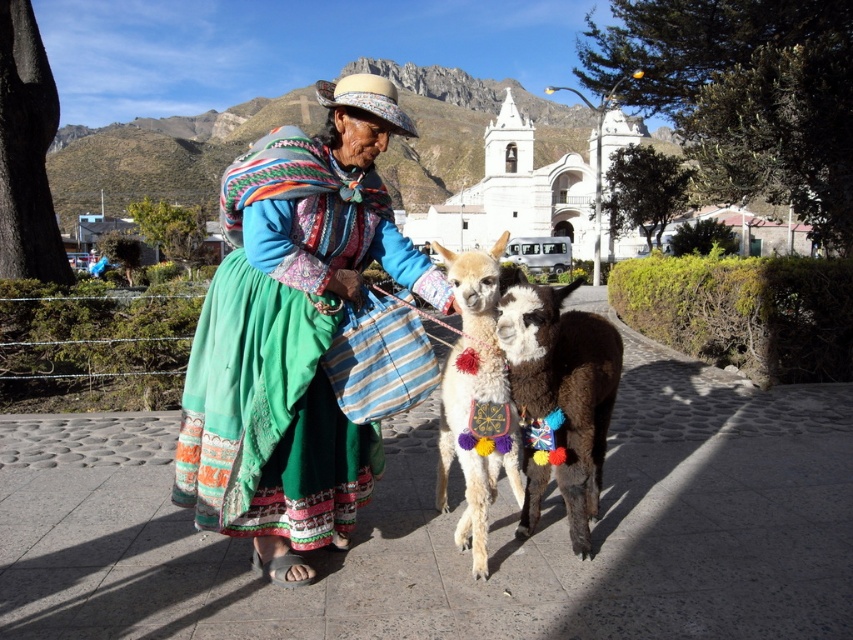
Which is below, matte green skirt at center or soft brown woolen camel at center?

soft brown woolen camel at center

What do you see at coordinates (293, 333) in the screenshot? The height and width of the screenshot is (640, 853). I see `matte green skirt at center` at bounding box center [293, 333].

The image size is (853, 640). In order to click on matte green skirt at center in this screenshot , I will do `click(293, 333)`.

Between point (271, 458) and point (468, 538), which one is positioned in front?

Point (271, 458) is in front.

Does point (177, 452) come in front of point (460, 276)?

Yes, point (177, 452) is closer to viewer.

Locate an element on the screen. matte green skirt at center is located at coordinates (293, 333).

Does soft brown woolen camel at center have a lesser height compared to fluffy white alpaca at center?

Indeed, soft brown woolen camel at center has a lesser height compared to fluffy white alpaca at center.

Is soft brown woolen camel at center bigger than fluffy white alpaca at center?

Incorrect, soft brown woolen camel at center is not larger than fluffy white alpaca at center.

Who is more forward, (535, 321) or (479, 332)?

Point (535, 321)

The height and width of the screenshot is (640, 853). In order to click on soft brown woolen camel at center in this screenshot , I will do `click(560, 397)`.